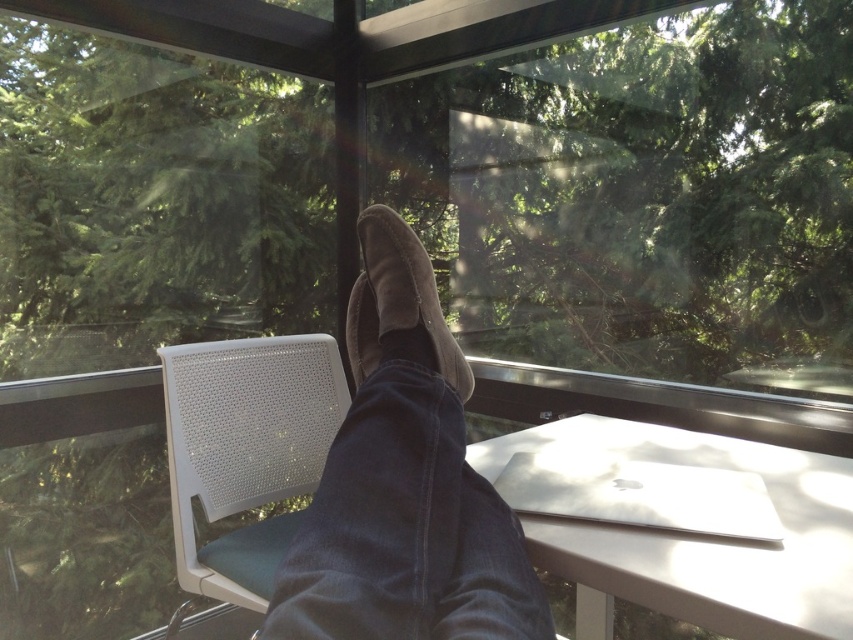
You are a delivery person trying to place a package on the white glossy table at lower right. However, the brown suede shoes at center are in the way. Can you place the package on the table without moving the shoes?

The brown suede shoes at center is taller than the white glossy table at lower right, so the shoes are blocking the table. You cannot place the package on the table without moving the shoes.